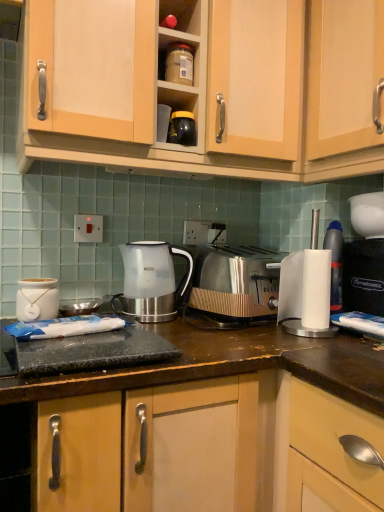
Question: Does wooden cabinet at upper center, marked as the 2th cabinetry in a right-to-left arrangement, appear on the right side of white ceramic jar at left?

Choices:
 (A) yes
 (B) no

Answer: (A)

Question: From a real-world perspective, is wooden cabinet at upper center, marked as the 2th cabinetry in a right-to-left arrangement, physically below white ceramic jar at left?

Choices:
 (A) no
 (B) yes

Answer: (A)

Question: From the image's perspective, is wooden cabinet at upper center, the 1th cabinetry in the left-to-right sequence, beneath white ceramic jar at left?

Choices:
 (A) yes
 (B) no

Answer: (B)

Question: Is wooden cabinet at upper center, the 1th cabinetry in the left-to-right sequence, in contact with white ceramic jar at left?

Choices:
 (A) yes
 (B) no

Answer: (B)

Question: From the image's perspective, is wooden cabinet at upper center, marked as the 2th cabinetry in a right-to-left arrangement, above or below satin metallic toaster at center?

Choices:
 (A) above
 (B) below

Answer: (A)

Question: Considering the positions of wooden cabinet at upper center, the 1th cabinetry in the left-to-right sequence, and satin metallic toaster at center in the image, is wooden cabinet at upper center, the 1th cabinetry in the left-to-right sequence, wider or thinner than satin metallic toaster at center?

Choices:
 (A) wide
 (B) thin

Answer: (A)

Question: Would you say wooden cabinet at upper center, the 1th cabinetry in the left-to-right sequence, is to the left or to the right of satin metallic toaster at center in the picture?

Choices:
 (A) right
 (B) left

Answer: (B)

Question: Is wooden cabinet at upper center, marked as the 2th cabinetry in a right-to-left arrangement, taller or shorter than satin metallic toaster at center?

Choices:
 (A) tall
 (B) short

Answer: (A)

Question: In terms of height, does black plastic bag at right look taller or shorter compared to wooden cabinet at upper center, the 1th cabinetry in the left-to-right sequence?

Choices:
 (A) tall
 (B) short

Answer: (B)

Question: Looking at their shapes, would you say black plastic bag at right is wider or thinner than wooden cabinet at upper center, the 1th cabinetry in the left-to-right sequence?

Choices:
 (A) thin
 (B) wide

Answer: (A)

Question: Is black plastic bag at right situated inside wooden cabinet at upper center, marked as the 2th cabinetry in a right-to-left arrangement, or outside?

Choices:
 (A) inside
 (B) outside

Answer: (B)

Question: Is point (372, 291) positioned closer to the camera than point (238, 32)?

Choices:
 (A) farther
 (B) closer

Answer: (A)

Question: Based on their sizes in the image, would you say light wood cabinet at upper right, arranged as the second cabinetry when viewed from the left, is bigger or smaller than black plastic bag at right?

Choices:
 (A) big
 (B) small

Answer: (A)

Question: Is light wood cabinet at upper right, arranged as the second cabinetry when viewed from the left, in front of or behind black plastic bag at right in the image?

Choices:
 (A) front
 (B) behind

Answer: (A)